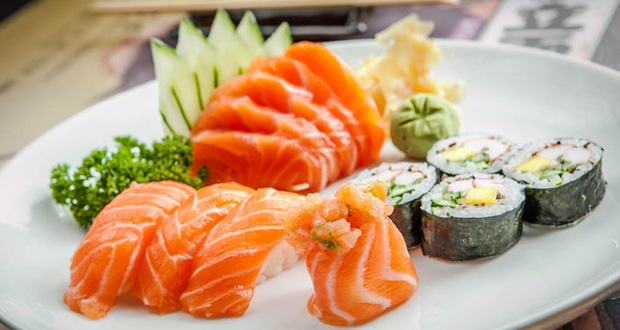
Locate an element on the screen. Image resolution: width=620 pixels, height=330 pixels. phone is located at coordinates (319, 28), (304, 14).